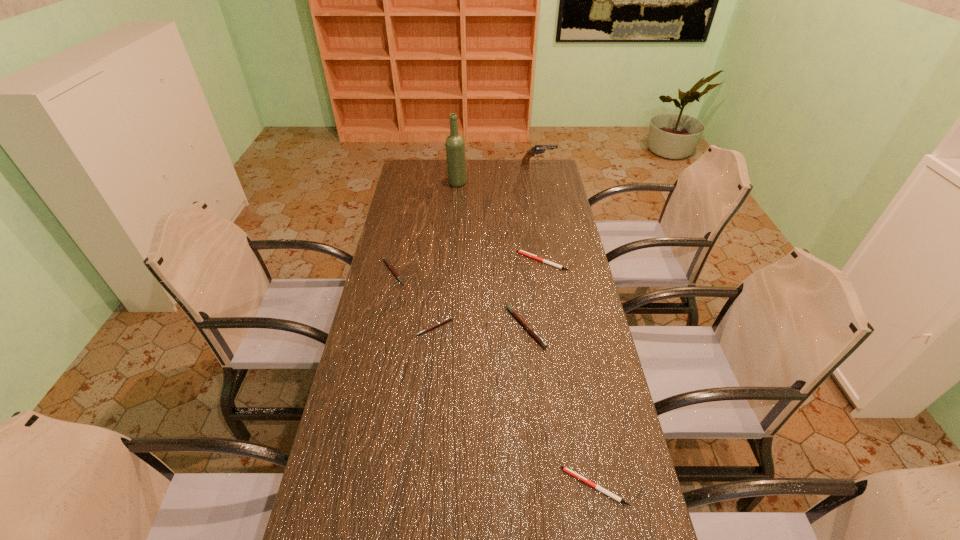
The image size is (960, 540). I want to click on free point located 0.260m on the clicker of the bigger white pen, so click(x=449, y=261).

Where is `free space located at the nib of the second pen from left to right`? This screenshot has width=960, height=540. free space located at the nib of the second pen from left to right is located at coordinates (428, 393).

Locate an element on the screen. The width and height of the screenshot is (960, 540). vacant area located 0.160m on the clicker of the smaller white pen is located at coordinates (497, 487).

Where is `vacant space located on the clicker of the smaller white pen`? The height and width of the screenshot is (540, 960). vacant space located on the clicker of the smaller white pen is located at coordinates (428, 487).

This screenshot has width=960, height=540. Identify the location of blank space located on the clicker of the smaller white pen. (461, 487).

Where is `wine bottle that is at the far edge`? wine bottle that is at the far edge is located at coordinates (455, 151).

The width and height of the screenshot is (960, 540). I want to click on gun that is at the far edge, so click(530, 153).

Find the location of a particular element. The height and width of the screenshot is (540, 960). object located at the left edge is located at coordinates (385, 259).

Identify the location of gun that is at the right edge. Image resolution: width=960 pixels, height=540 pixels. (530, 153).

This screenshot has height=540, width=960. What are the coordinates of `object positioned at the far right corner` in the screenshot? It's located at (530, 153).